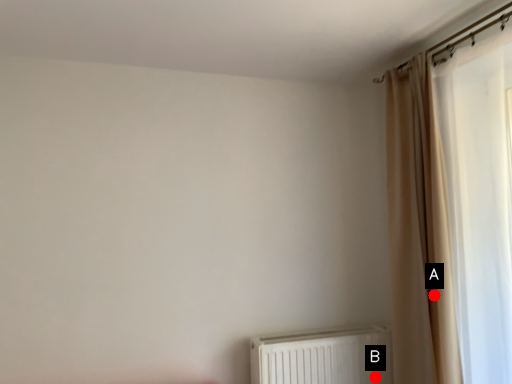
Question: Two points are circled on the image, labeled by A and B beside each circle. Which point is farther to the camera?

Choices:
 (A) A is further
 (B) B is further

Answer: (B)